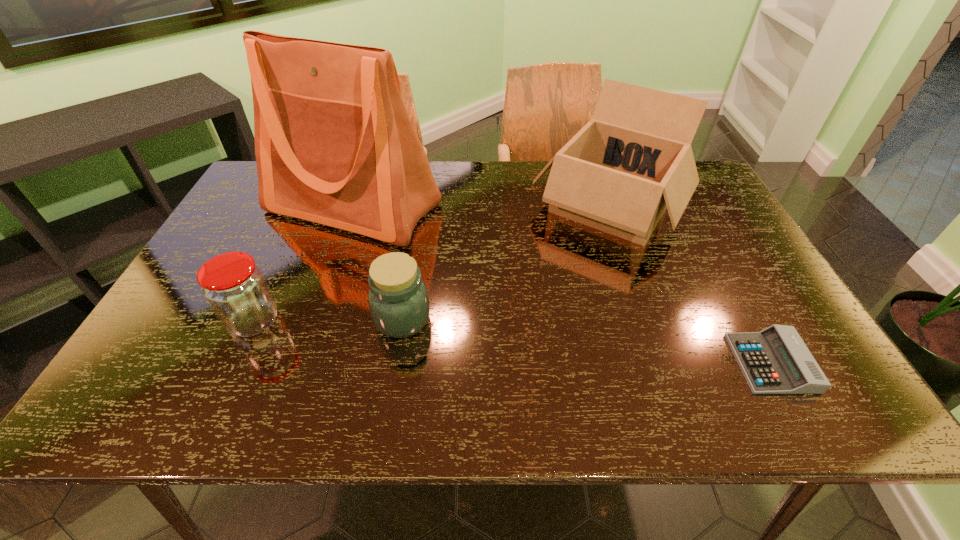
Identify the location of vacant region at the far edge of the desktop. (529, 199).

You are a GUI agent. You are given a task and a screenshot of the screen. Output one action in this format:
    pyautogui.click(x=<x>, y=<y>)
    Task: Click on the free space at the near edge
    
    Given the screenshot: What is the action you would take?
    pyautogui.click(x=214, y=412)

Locate an element on the screen. The height and width of the screenshot is (540, 960). vacant space at the left edge is located at coordinates (222, 235).

The height and width of the screenshot is (540, 960). In order to click on vacant area at the right edge of the desktop in this screenshot , I will do `click(730, 246)`.

The width and height of the screenshot is (960, 540). I want to click on vacant region at the near left corner of the desktop, so click(145, 401).

Image resolution: width=960 pixels, height=540 pixels. What are the coordinates of `vacant space at the far right corner` in the screenshot? It's located at (698, 198).

The image size is (960, 540). I want to click on vacant space at the near right corner, so click(x=832, y=405).

Locate an element on the screen. The image size is (960, 540). free point between the second tallest object and the right jar is located at coordinates (506, 262).

Where is `vacant space that's between the calculator and the left jar`? vacant space that's between the calculator and the left jar is located at coordinates (513, 342).

You are a GUI agent. You are given a task and a screenshot of the screen. Output one action in this format:
    pyautogui.click(x=<x>, y=<y>)
    Task: Click on the free point between the box and the right jar
    
    Given the screenshot: What is the action you would take?
    pyautogui.click(x=506, y=262)